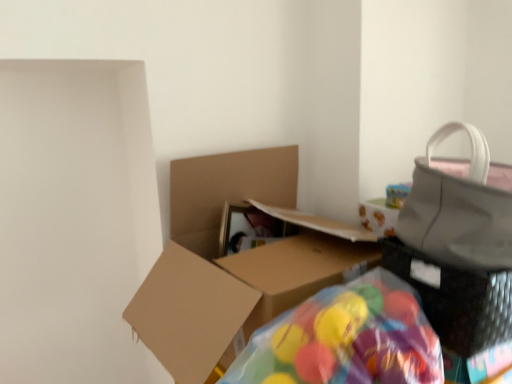
Question: Is matte gray handbag at right bigger or smaller than translucent plastic bean bag chair at lower center?

Choices:
 (A) big
 (B) small

Answer: (A)

Question: From a real-world perspective, is matte gray handbag at right physically located above or below translucent plastic bean bag chair at lower center?

Choices:
 (A) above
 (B) below

Answer: (A)

Question: Based on their relative distances, which object is nearer to the brown cardboard box at center?

Choices:
 (A) matte gray handbag at right
 (B) translucent plastic bean bag chair at lower center

Answer: (B)

Question: Which of these objects is positioned farthest from the translucent plastic bean bag chair at lower center?

Choices:
 (A) matte gray handbag at right
 (B) brown cardboard box at center

Answer: (B)